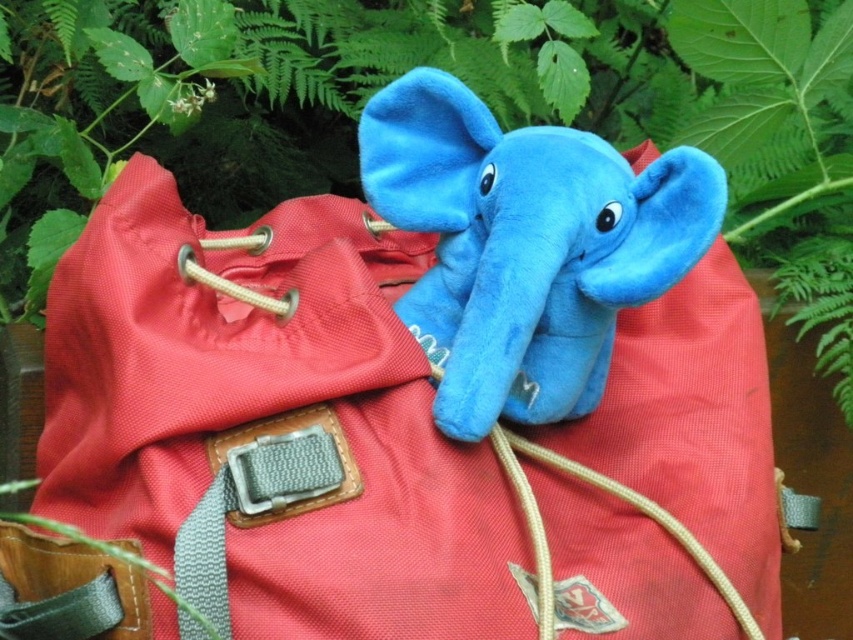
You are packing for a hiking trip and have a coral fabric backpack at center and a matte beige strap at center. Which item can hold more items based on their size?

The coral fabric backpack at center is larger in size than the matte beige strap at center, so it can hold more items.

You are standing 2 feet away from the coral fabric backpack at center. Can you reach it without moving your feet?

The coral fabric backpack at center is 19.07 inches away from camera. Since 2 feet is approximately 24 inches, you are standing farther away than the distance to the backpack, so you cannot reach it without moving your feet.

You are standing in front of the backpack and want to place a sticker on the part of the backpack that is closer to you. Which point should you choose between point (x=381, y=424) and point (x=413, y=291)?

Point (x=381, y=424) is in front of point (x=413, y=291), so you should choose point (x=381, y=424) to place the sticker on the part of the backpack that is closer to you.